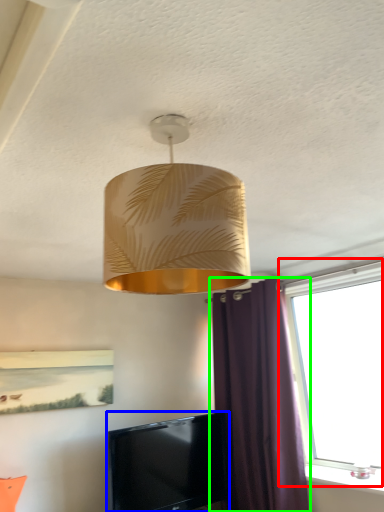
Question: Which object is the closest to the window (highlighted by a red box)? Choose among these: television (highlighted by a blue box) or curtain (highlighted by a green box).

Choices:
 (A) television
 (B) curtain

Answer: (B)